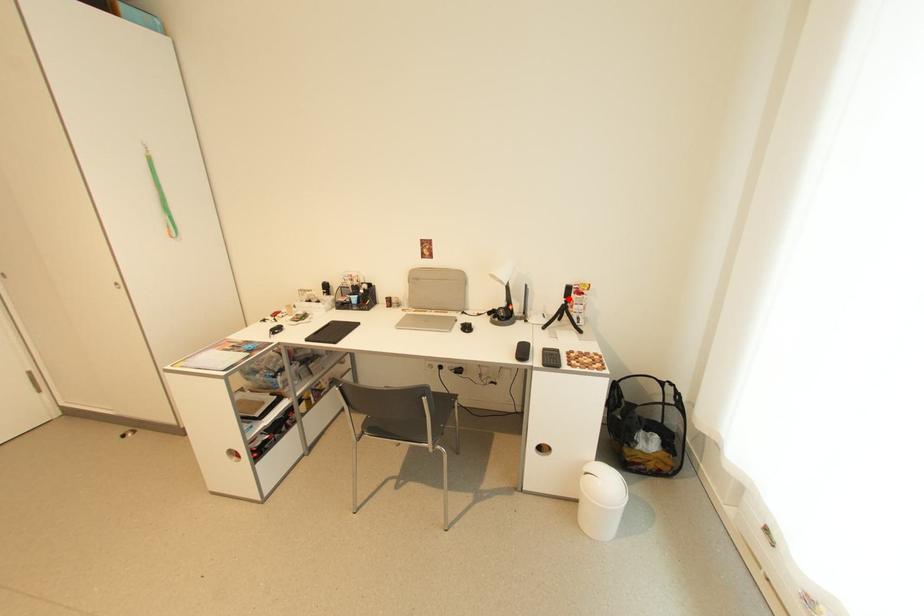
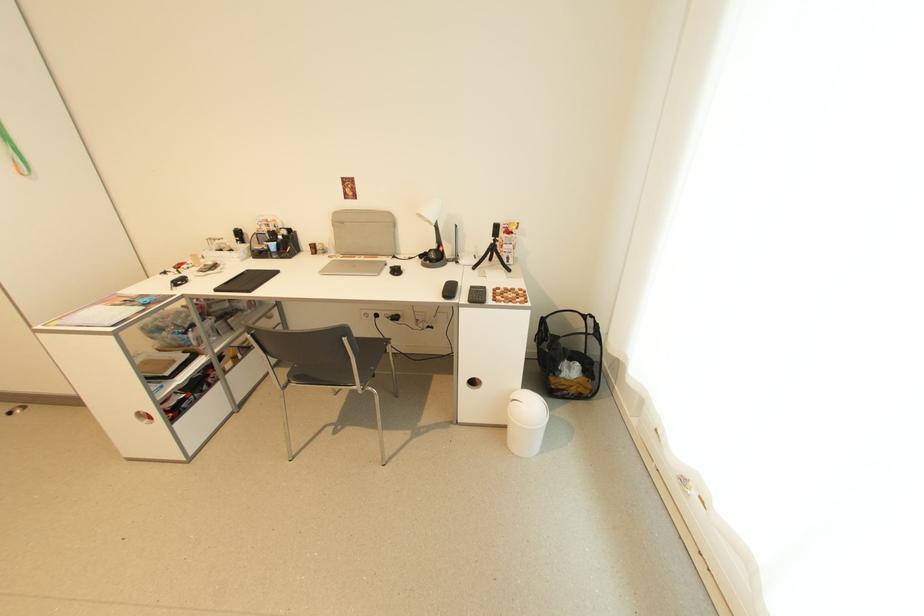
Locate, in the second image, the point that corresponds to the highlighted location in the first image.

(497, 238)